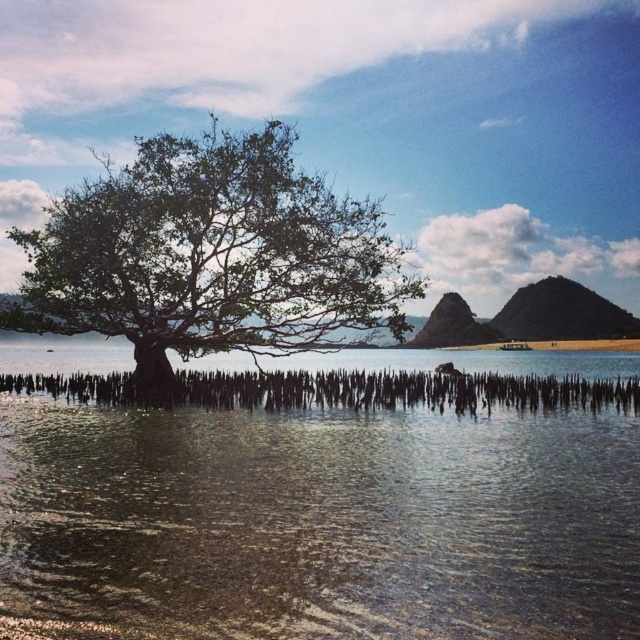
You are a hiker who wants to cross the clear water at center to reach the green leafy tree at center. Based on the scene description, which direction should you head from the tree to avoid getting wet?

The clear water at center is to the right of green leafy tree at center, so to avoid getting wet, you should head to the left of the green leafy tree at center to cross.

You are a photographer aiming to capture the green leafy tree at center and the clear water at center in a single shot. Based on their heights, which one will appear taller in the photograph?

The green leafy tree at center is taller than the clear water at center, so it will appear taller in the photograph.

You are standing at the base of the mangrove tree and want to determine which of the two points, point (104, 420) or point (192, 244), is closer to you. Based on the image, which point is nearer?

Point (104, 420) is closer to the viewer than point (192, 244).